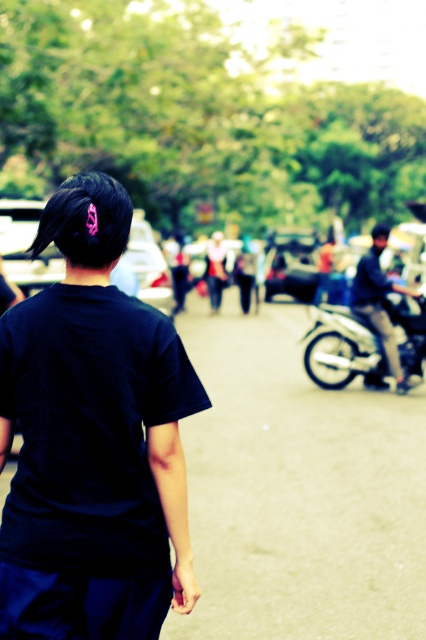
Who is more distant from viewer, (89, 220) or (210, 301)?

The point (210, 301) is behind.

Can you confirm if pink plastic hair clip at upper left is positioned above matte white shirt at center?

No, pink plastic hair clip at upper left is not above matte white shirt at center.

Locate an element on the screen. pink plastic hair clip at upper left is located at coordinates (86, 220).

The image size is (426, 640). Find the location of `pink plastic hair clip at upper left`. pink plastic hair clip at upper left is located at coordinates pos(86,220).

Does metallic silver motorcycle at right have a greater width compared to dark blue jeans at center?

Indeed, metallic silver motorcycle at right has a greater width compared to dark blue jeans at center.

Who is positioned more to the right, metallic silver motorcycle at right or dark blue jeans at center?

dark blue jeans at center

Who is more distant from viewer, (406, 356) or (385, 237)?

The point (406, 356) is behind.

You are a GUI agent. You are given a task and a screenshot of the screen. Output one action in this format:
    pyautogui.click(x=<x>, y=<y>)
    Task: Click on the metallic silver motorcycle at right
    The image size is (426, 640).
    Given the screenshot: What is the action you would take?
    pyautogui.click(x=344, y=348)

Is dark blue jeans at center wider than matte white shirt at center?

Correct, the width of dark blue jeans at center exceeds that of matte white shirt at center.

Can you confirm if dark blue jeans at center is positioned to the left of matte white shirt at center?

No, dark blue jeans at center is not to the left of matte white shirt at center.

At what (x,y) coordinates should I click in order to perform the action: click on dark blue jeans at center. Please return your answer as a coordinate pair (x, y). Image resolution: width=426 pixels, height=640 pixels. Looking at the image, I should click on (379, 301).

The width and height of the screenshot is (426, 640). Identify the location of dark blue jeans at center. (379, 301).